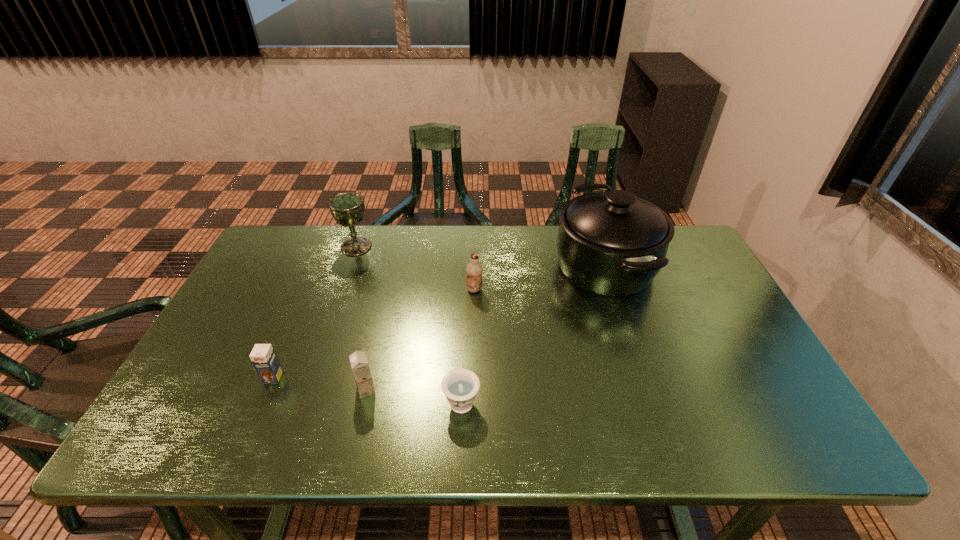
Locate an element on the screen. saucepan is located at coordinates (613, 243).

Locate an element on the screen. The image size is (960, 540). the tallest object is located at coordinates (613, 243).

This screenshot has width=960, height=540. I want to click on the fifth shortest object, so click(x=347, y=208).

Find the location of a particular element. The width and height of the screenshot is (960, 540). chalice is located at coordinates (347, 208).

At what (x,y) coordinates should I click in order to perform the action: click on the rightmost chocolate milk. Please return your answer as a coordinate pair (x, y). The image size is (960, 540). Looking at the image, I should click on (474, 269).

What are the coordinates of `the second chocolate milk from left to right` in the screenshot? It's located at (360, 367).

At what (x,y) coordinates should I click in order to perform the action: click on the leftmost object. Please return your answer as a coordinate pair (x, y). Looking at the image, I should click on coord(263,357).

This screenshot has height=540, width=960. What are the coordinates of `the shortest object` in the screenshot? It's located at (460, 386).

This screenshot has height=540, width=960. Identify the location of vacant space positioned on the left of the saucepan. (518, 265).

Where is `free spot located on the front of the fifth shortest object`? This screenshot has width=960, height=540. free spot located on the front of the fifth shortest object is located at coordinates (337, 301).